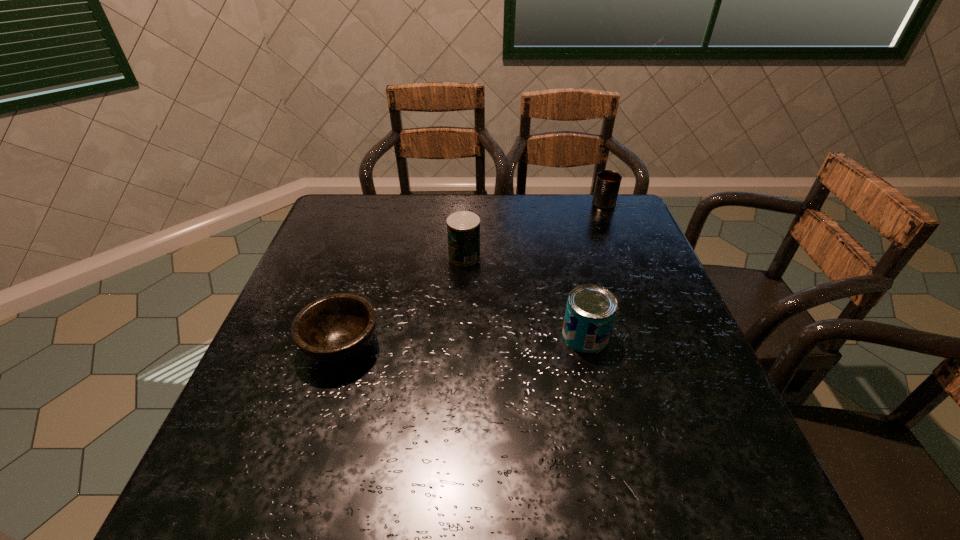
Where is `free space located on the back of the nearest can`? free space located on the back of the nearest can is located at coordinates (570, 272).

Where is `blank space located on the back of the shortest object`? blank space located on the back of the shortest object is located at coordinates (369, 256).

Image resolution: width=960 pixels, height=540 pixels. I want to click on object located in the far edge section of the desktop, so click(x=608, y=182).

Identify the location of object that is at the left edge. This screenshot has height=540, width=960. (335, 328).

The width and height of the screenshot is (960, 540). In order to click on object that is at the right edge in this screenshot , I will do (x=608, y=182).

The image size is (960, 540). I want to click on object present at the far right corner, so click(x=608, y=182).

The width and height of the screenshot is (960, 540). In the image, there is a desktop. Find the location of `free space at the far edge`. free space at the far edge is located at coordinates (396, 194).

In the image, there is a desktop. Identify the location of vacant space at the near edge. This screenshot has width=960, height=540. (659, 490).

Find the location of a particular element. vacant space at the left edge is located at coordinates (308, 261).

Identify the location of free space at the right edge of the desktop. This screenshot has height=540, width=960. [x=684, y=416].